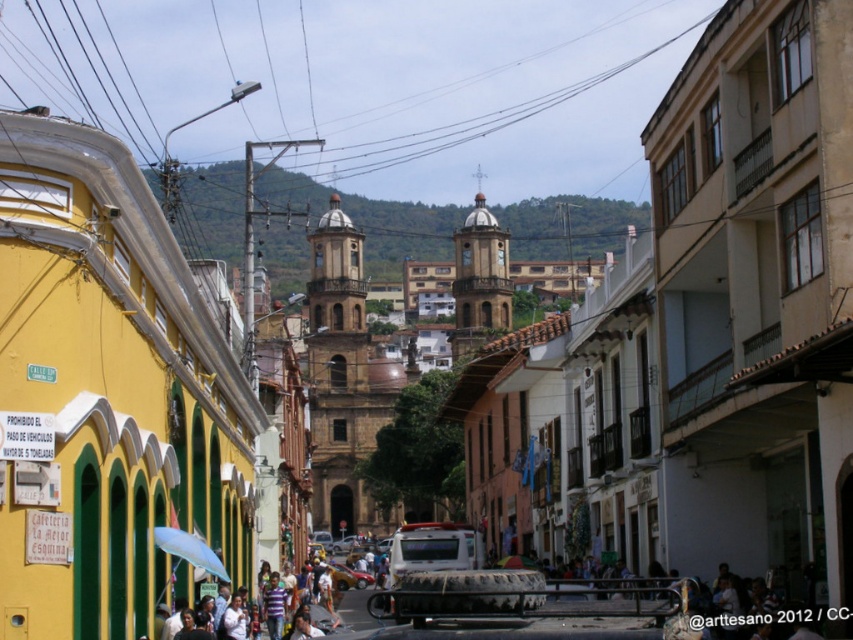
Question: Which point is closer to the camera?

Choices:
 (A) (173, 544)
 (B) (351, 573)

Answer: (A)

Question: Can you confirm if white matte umbrella at lower center is smaller than metallic silver car at center?

Choices:
 (A) yes
 (B) no

Answer: (A)

Question: Which of the following is the farthest from the observer?

Choices:
 (A) metallic silver car at center
 (B) white matte umbrella at lower center

Answer: (A)

Question: Can you confirm if white matte umbrella at lower center is bigger than metallic silver car at center?

Choices:
 (A) no
 (B) yes

Answer: (A)

Question: In this image, where is white matte umbrella at lower center located relative to metallic silver car at center?

Choices:
 (A) right
 (B) left

Answer: (B)